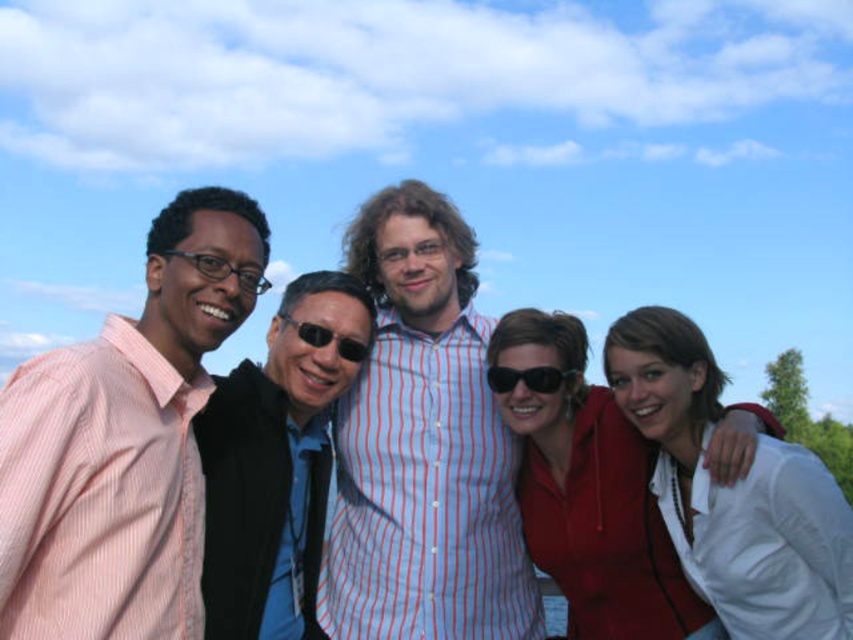
Question: Which point is farther to the camera?

Choices:
 (A) (693, 451)
 (B) (405, 326)
 (C) (498, 392)
 (D) (184, 253)

Answer: (B)

Question: Is striped cotton shirt at center above matte red blouse at center?

Choices:
 (A) yes
 (B) no

Answer: (A)

Question: Which point appears farthest from the camera in this image?

Choices:
 (A) (190, 525)
 (B) (621, 371)
 (C) (505, 371)
 (D) (651, 563)

Answer: (C)

Question: Is striped cotton shirt at center smaller than matte red blouse at center?

Choices:
 (A) yes
 (B) no

Answer: (B)

Question: Does striped cotton shirt at center come in front of matte black glasses at left?

Choices:
 (A) no
 (B) yes

Answer: (A)

Question: Which object appears farthest from the camera in this image?

Choices:
 (A) black plastic sunglasses at center
 (B) matte black glasses at left
 (C) black reflective sunglasses at center
 (D) striped cotton shirt at center

Answer: (D)